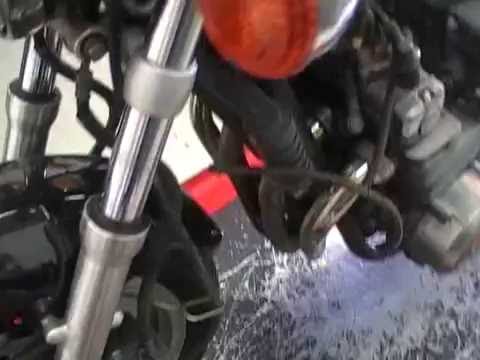
I want to click on red piece on floor, so click(x=224, y=192), click(x=209, y=176), click(x=193, y=188), click(x=213, y=200).